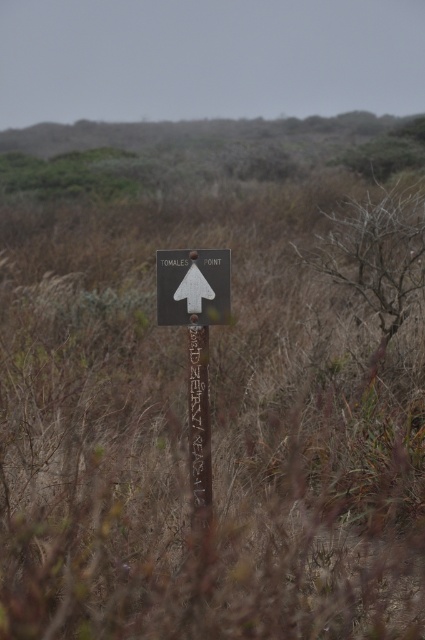
Question: Among these points, which one is farthest from the camera?

Choices:
 (A) (201, 426)
 (B) (200, 316)
 (C) (203, 285)

Answer: (A)

Question: Which object is farther from the camera taking this photo?

Choices:
 (A) metallic sign at center
 (B) wooden signpost at center

Answer: (A)

Question: Does metallic sign at center appear under wooden signpost at center?

Choices:
 (A) yes
 (B) no

Answer: (B)

Question: Which object is positioned closest to the metallic sign at center?

Choices:
 (A) metallic gray signpost at center
 (B) white matte arrow at center

Answer: (B)

Question: Does metallic gray signpost at center appear over metallic sign at center?

Choices:
 (A) yes
 (B) no

Answer: (B)

Question: Is metallic sign at center positioned at the back of wooden signpost at center?

Choices:
 (A) no
 (B) yes

Answer: (B)